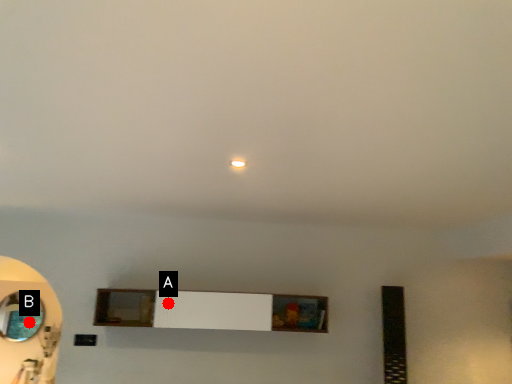
Question: Two points are circled on the image, labeled by A and B beside each circle. Which point is farther to the camera?

Choices:
 (A) A is further
 (B) B is further

Answer: (A)